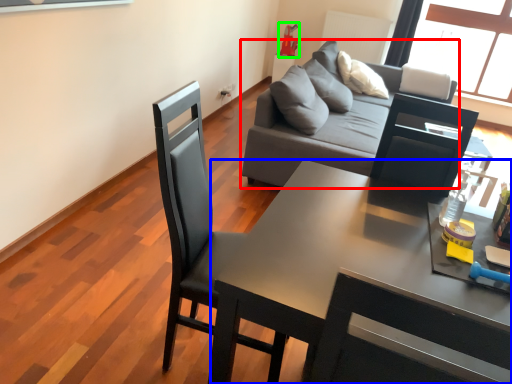
Question: Which is nearer to the studio couch (highlighted by a red box)? desk (highlighted by a blue box) or toy (highlighted by a green box).

Choices:
 (A) desk
 (B) toy

Answer: (A)